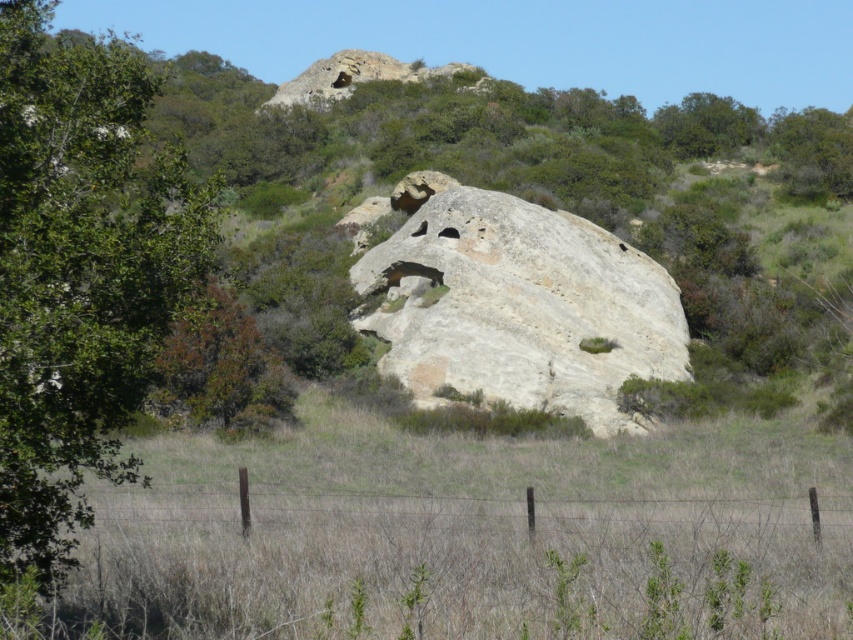
Question: Can you confirm if green leafy tree at left is smaller than light gray rock at center?

Choices:
 (A) no
 (B) yes

Answer: (A)

Question: Can you confirm if light gray rock at center is smaller than green leafy shrub at center-left?

Choices:
 (A) yes
 (B) no

Answer: (B)

Question: Among these objects, which one is farthest from the camera?

Choices:
 (A) light gray rock at center
 (B) brown wire fence at lower center
 (C) green leafy tree at upper right
 (D) green leafy shrub at center-left

Answer: (C)

Question: Can you confirm if light gray rock at center is smaller than green leafy tree at upper right?

Choices:
 (A) yes
 (B) no

Answer: (A)

Question: Which of the following is the closest to the observer?

Choices:
 (A) green leafy tree at left
 (B) brown wire fence at lower center
 (C) green leafy shrub at center-left
 (D) green leafy tree at upper right

Answer: (A)

Question: Based on their relative distances, which object is nearer to the green leafy shrub at center-left?

Choices:
 (A) green leafy tree at left
 (B) brown wire fence at lower center
 (C) light gray rock at center
 (D) green leafy tree at upper right

Answer: (C)